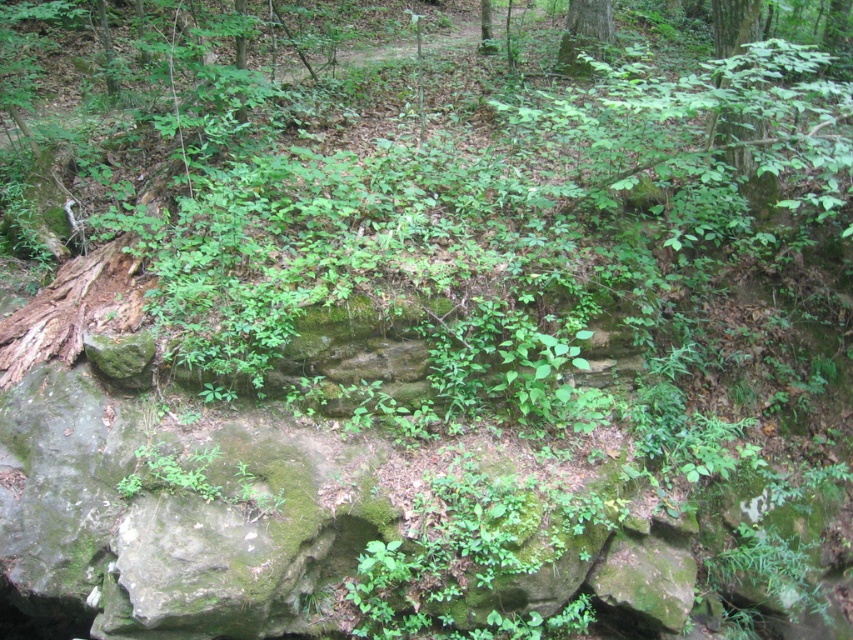
Does green leafy tree at upper right have a greater height compared to green leafy tree at center?

No.

Is point (720, 35) closer to viewer compared to point (486, 12)?

Yes, point (720, 35) is in front of point (486, 12).

Where is `green leafy tree at upper right`? green leafy tree at upper right is located at coordinates (734, 24).

Based on the photo, can you confirm if green leafy tree at upper right is wider than green mossy tree at upper center?

Incorrect, green leafy tree at upper right's width does not surpass green mossy tree at upper center's.

Looking at this image, between green leafy tree at upper right and green mossy tree at upper center, which one has more height?

green mossy tree at upper center

Between point (720, 36) and point (560, 64), which one is positioned behind?

Positioned behind is point (560, 64).

You are a GUI agent. You are given a task and a screenshot of the screen. Output one action in this format:
    pyautogui.click(x=<x>, y=<y>)
    Task: Click on the green leafy tree at upper right
    The width and height of the screenshot is (853, 640).
    Given the screenshot: What is the action you would take?
    pyautogui.click(x=734, y=24)

Which is in front, point (589, 67) or point (486, 33)?

Positioned in front is point (589, 67).

Who is more distant from viewer, (608,10) or (494,48)?

The point (494,48) is behind.

Where is `green mossy tree at upper center`? This screenshot has width=853, height=640. green mossy tree at upper center is located at coordinates (584, 35).

At what (x,y) coordinates should I click in order to perform the action: click on green mossy tree at upper center. Please return your answer as a coordinate pair (x, y). Looking at the image, I should click on (584, 35).